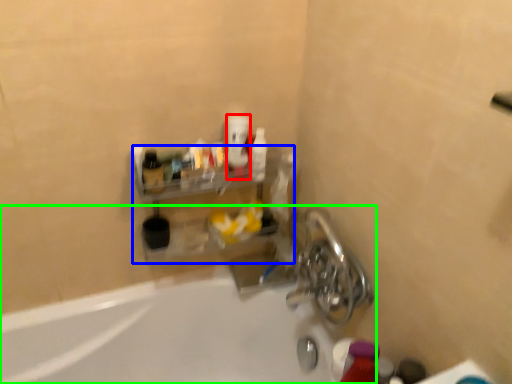
Question: Which is farther away from mouthwash (highlighted by a red box)? shelf (highlighted by a blue box) or bathtub (highlighted by a green box)?

Choices:
 (A) shelf
 (B) bathtub

Answer: (B)